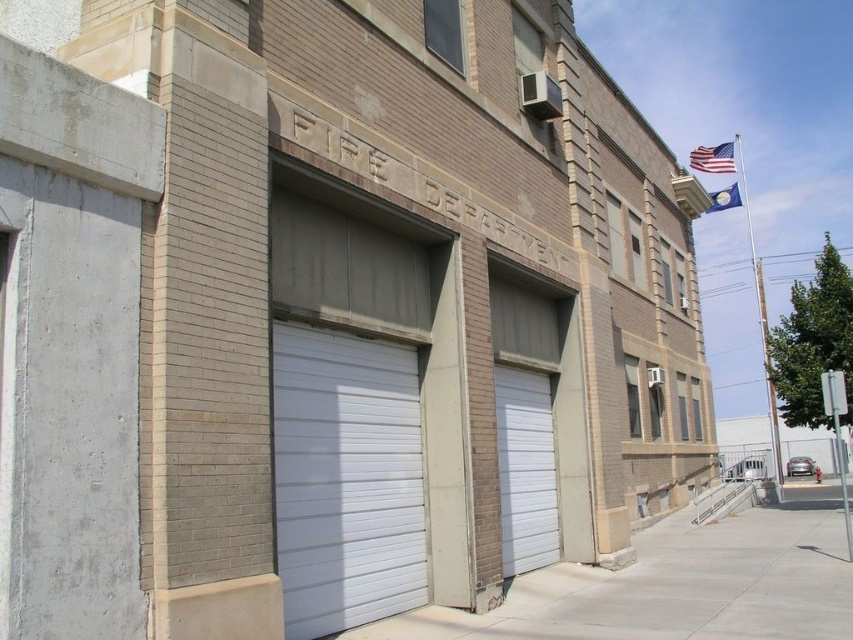
You are standing in front of the fire department building. There is a point at coordinate [345,477]. What object is located at that point?

The white metallic garage door at center is located at point [345,477].

You are a firefighter trying to locate the main entrance to the fire department building. You see the white metallic garage door at center. Is the main entrance located above or below this door?

The main entrance is likely located below the white metallic garage door at center, as garage doors are typically at ground level where vehicles exit and enter.

You are standing at the entrance of the fire department building and see two points marked on the facade. The first point is at coordinate point (693, 148) and the second is at point (740, 204). From your vantage point, which point is closer to you?

Point (740, 204) is closer to you because point (693, 148) is behind it.